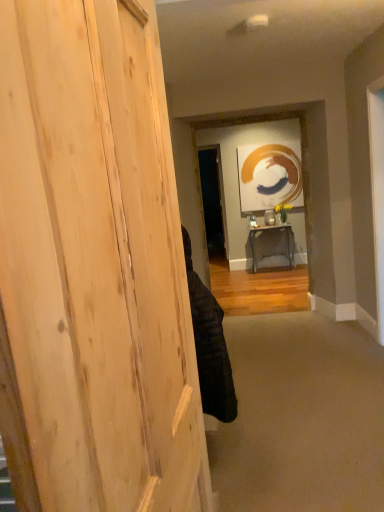
At what (x,y) coordinates should I click in order to perform the action: click on beige carpet at lower center. Please return your answer as a coordinate pair (x, y). Looking at the image, I should click on (301, 417).

Find the location of a particular element. The width and height of the screenshot is (384, 512). natural wood door at left is located at coordinates (95, 263).

What is the approximate width of natural wood door at left?

It is 32.53 inches.

Identify the location of wooden table at center. This screenshot has height=512, width=384. (271, 230).

At what (x,y) coordinates should I click in order to perform the action: click on beige carpet at lower center. Please return your answer as a coordinate pair (x, y). The height and width of the screenshot is (512, 384). Looking at the image, I should click on (301, 417).

Between beige carpet at lower center and wooden table at center, which one has larger width?

Answer: With larger width is beige carpet at lower center.

Is beige carpet at lower center turned away from wooden table at center?

No.

Between beige carpet at lower center and wooden table at center, which one appears on the left side from the viewer's perspective?

Positioned to the left is beige carpet at lower center.

Considering the positions of points (308, 358) and (252, 233), is point (308, 358) closer to camera compared to point (252, 233)?

Yes, it is.

Which is closer, (332, 328) or (195, 305)?

The point (195, 305) is in front.

Relative to black fabric at center, is beige carpet at lower center in front or behind?

Clearly, beige carpet at lower center is in front of black fabric at center.

What's the angular difference between beige carpet at lower center and black fabric at center's facing directions?

The angular difference between beige carpet at lower center and black fabric at center is 95.2 degrees.

Considering the relative positions of beige carpet at lower center and black fabric at center in the image provided, is beige carpet at lower center to the left or to the right of black fabric at center?

From the image, it's evident that beige carpet at lower center is to the right of black fabric at center.

You are a GUI agent. You are given a task and a screenshot of the screen. Output one action in this format:
    pyautogui.click(x=<x>, y=<y>)
    Task: Click on the person below the natural wood door at left (from a real-world perspective)
    This screenshot has width=384, height=512.
    Given the screenshot: What is the action you would take?
    pyautogui.click(x=210, y=346)

In the scene shown: Is black fabric at center wider or thinner than natural wood door at left?

Clearly, black fabric at center has less width compared to natural wood door at left.

Between black fabric at center and natural wood door at left, which one has less height?

Standing shorter between the two is black fabric at center.

Would you consider black fabric at center to be distant from natural wood door at left?

No, there isn't a large distance between black fabric at center and natural wood door at left.

Would you consider natural wood door at left to be distant from black fabric at center?

No, there isn't a large distance between natural wood door at left and black fabric at center.

From the image's perspective, is natural wood door at left on black fabric at center?

Correct, natural wood door at left appears higher than black fabric at center in the image.

Based on the photo, is natural wood door at left spatially inside black fabric at center, or outside of it?

natural wood door at left exists outside the volume of black fabric at center.

What's the angular difference between natural wood door at left and black fabric at center's facing directions?

The facing directions of natural wood door at left and black fabric at center are 103 degrees apart.

From the image's perspective, is black fabric at center under wooden table at center?

Yes, from the image's perspective, black fabric at center is below wooden table at center.

How different are the orientations of black fabric at center and wooden table at center in degrees?

The angle between the facing direction of black fabric at center and the facing direction of wooden table at center is 95.1 degrees.

From a real-world perspective, between black fabric at center and wooden table at center, who is vertically lower?

From a 3D spatial view, wooden table at center is below.

Is black fabric at center inside or outside of wooden table at center?

black fabric at center is outside wooden table at center.

Which of these two, wooden table at center or black fabric at center, is thinner?

black fabric at center.

Is wooden table at center not near black fabric at center?

Yes.

Is wooden table at center located outside black fabric at center?

Yes, wooden table at center is outside of black fabric at center.

Which is more to the left, black fabric at center or beige carpet at lower center?

black fabric at center.

Which is more distant, (215, 325) or (338, 443)?

The point (338, 443) is farther.

Can you confirm if black fabric at center is shorter than beige carpet at lower center?

No, black fabric at center is not shorter than beige carpet at lower center.

Is black fabric at center turned away from beige carpet at lower center?

black fabric at center is not turned away from beige carpet at lower center.

Where is `plain below the wooden table at center (from the image's perspective)`? The height and width of the screenshot is (512, 384). plain below the wooden table at center (from the image's perspective) is located at coordinates (301, 417).

Find the location of a particular element. person behind the beige carpet at lower center is located at coordinates (210, 346).

Looking at this image, estimate the real-world distances between objects in this image. Which object is further from black fabric at center, wooden table at center or beige carpet at lower center?

wooden table at center is further to black fabric at center.

Looking at the image, which one is located further to natural wood door at left, black fabric at center or wooden table at center?

The object further to natural wood door at left is wooden table at center.

Considering their positions, is beige carpet at lower center positioned further to black fabric at center than wooden table at center?

wooden table at center is further to black fabric at center.

Consider the image. Looking at the image, which one is located closer to wooden table at center, natural wood door at left or beige carpet at lower center?

beige carpet at lower center.

From the image, which object appears to be nearer to natural wood door at left, beige carpet at lower center or black fabric at center?

Among the two, black fabric at center is located nearer to natural wood door at left.

Based on their spatial positions, is wooden table at center or black fabric at center further from beige carpet at lower center?

Based on the image, wooden table at center appears to be further to beige carpet at lower center.

Based on their spatial positions, is natural wood door at left or black fabric at center closer to wooden table at center?

Based on the image, black fabric at center appears to be nearer to wooden table at center.

Estimate the real-world distances between objects in this image. Which object is closer to wooden table at center, beige carpet at lower center or black fabric at center?

beige carpet at lower center lies closer to wooden table at center than the other object.

The width and height of the screenshot is (384, 512). Identify the location of person positioned between beige carpet at lower center and wooden table at center from near to far. (210, 346).

Find the location of `plain between natural wood door at left and black fabric at center from front to back`. plain between natural wood door at left and black fabric at center from front to back is located at coordinates (301, 417).

Locate an element on the screen. The width and height of the screenshot is (384, 512). person positioned between natural wood door at left and wooden table at center from near to far is located at coordinates (210, 346).

Locate an element on the screen. plain located between natural wood door at left and wooden table at center in the depth direction is located at coordinates (301, 417).